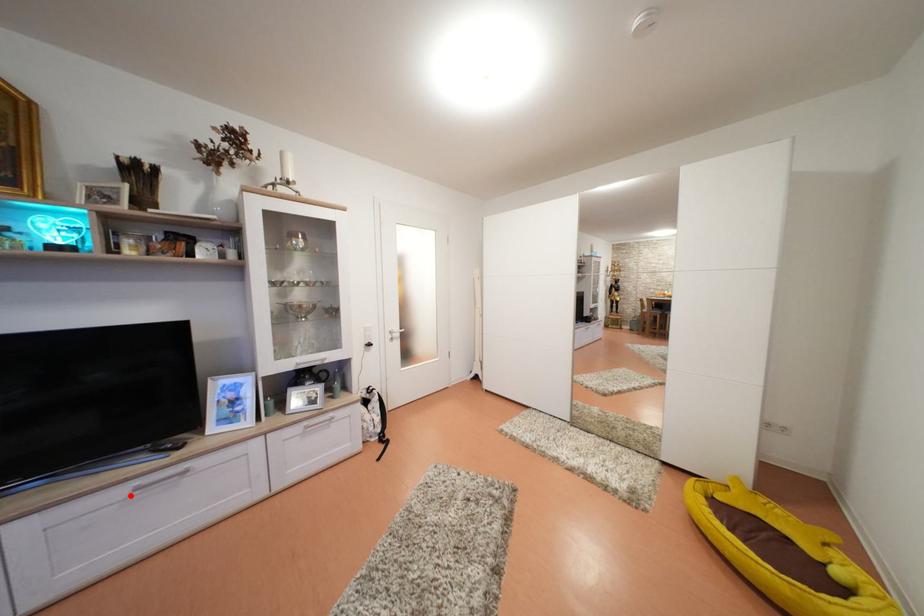
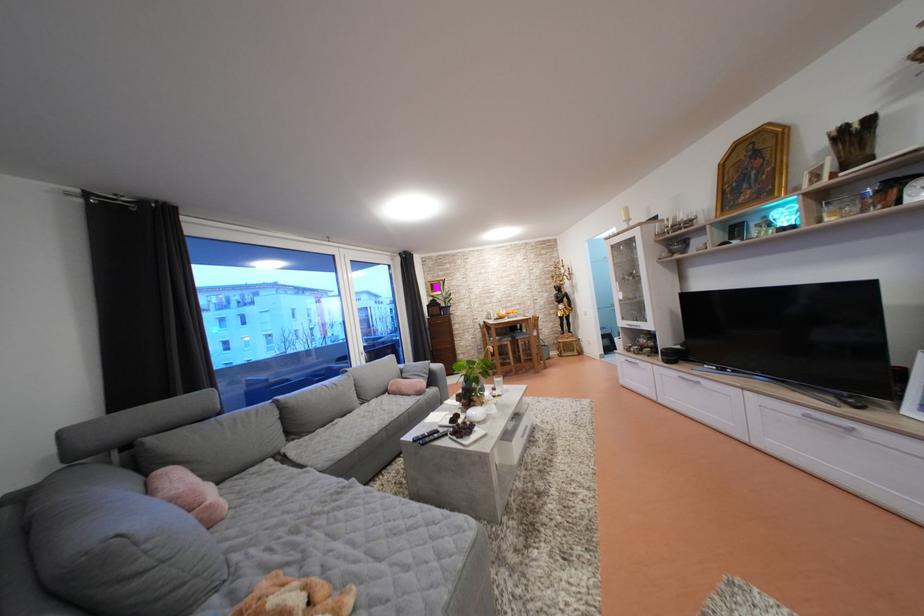
The point at the highlighted location is marked in the first image. Where is the corresponding point in the second image?

(805, 416)